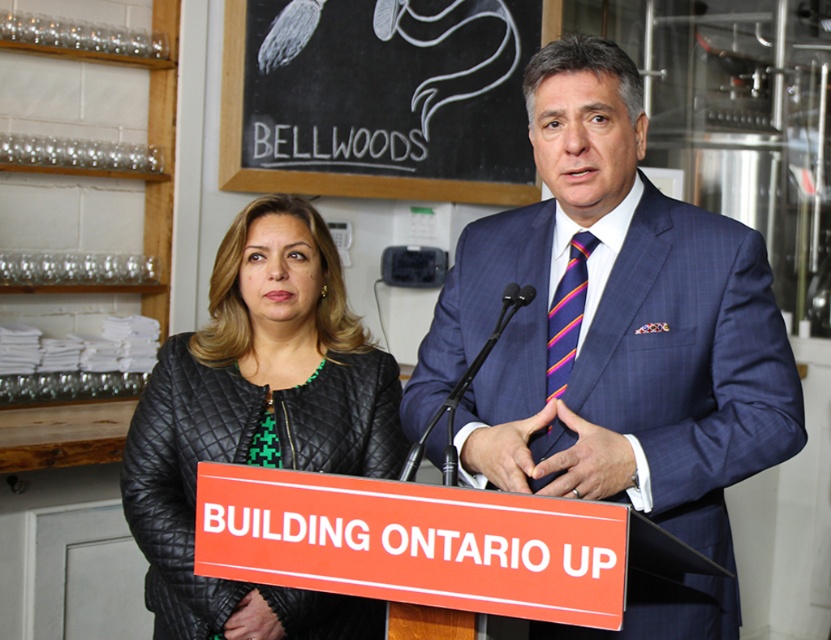
Who is more forward, (x=638, y=90) or (x=559, y=376)?

Positioned in front is point (x=638, y=90).

Between blue textured suit at center and striped silk tie at center, which one is positioned higher?

Positioned higher is striped silk tie at center.

Does point (568, 237) come behind point (554, 294)?

Yes, point (568, 237) is farther from viewer.

Locate an element on the screen. This screenshot has height=640, width=831. blue textured suit at center is located at coordinates (613, 324).

Which is more to the left, black quilted jacket at center or striped silk tie at center?

black quilted jacket at center is more to the left.

Which of these two, black quilted jacket at center or striped silk tie at center, stands shorter?

striped silk tie at center

Where is `black quilted jacket at center`? The image size is (831, 640). black quilted jacket at center is located at coordinates (258, 420).

Looking at this image, which of these two, black quilted jacket at center or black chalkboard at upper center, stands taller?

With more height is black quilted jacket at center.

The width and height of the screenshot is (831, 640). What do you see at coordinates (258, 420) in the screenshot? I see `black quilted jacket at center` at bounding box center [258, 420].

Identify the location of black quilted jacket at center. Image resolution: width=831 pixels, height=640 pixels. (258, 420).